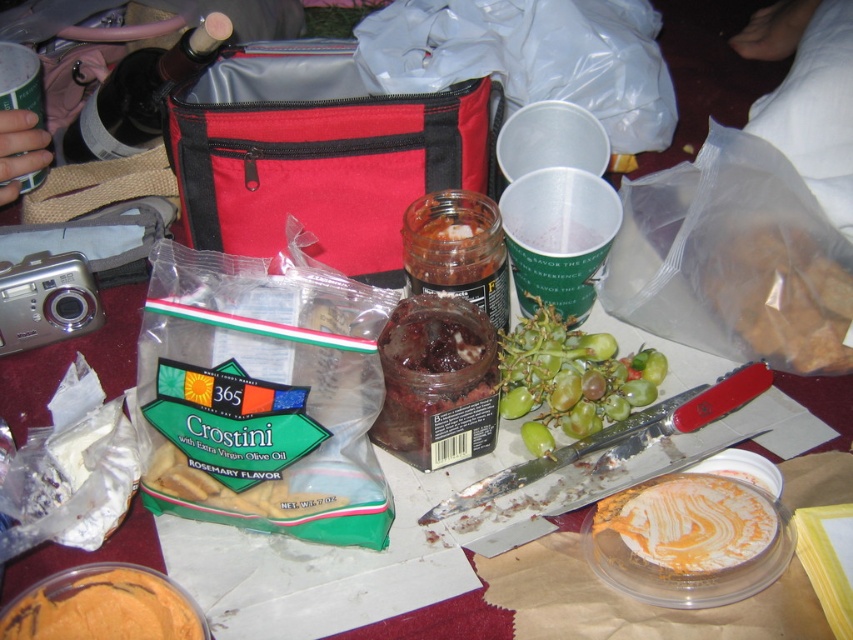
Question: Is shiny dark red jam at center wider than smooth orange spread at center?

Choices:
 (A) yes
 (B) no

Answer: (B)

Question: Which object is closer to the camera taking this photo?

Choices:
 (A) shiny dark red jam at center
 (B) green matte grapes at center

Answer: (A)

Question: Which point appears closest to the camera in this image?

Choices:
 (A) (778, 266)
 (B) (722, 506)

Answer: (B)

Question: Can you confirm if green matte grapes at center is positioned below golden crostini at center?

Choices:
 (A) yes
 (B) no

Answer: (B)

Question: Estimate the real-world distances between objects in this image. Which object is farther from the brown crumbly at center?

Choices:
 (A) golden crostini at center
 (B) green matte grapes at center

Answer: (A)

Question: Can you confirm if green matte grapes at center is positioned below smooth orange spread at center?

Choices:
 (A) yes
 (B) no

Answer: (B)